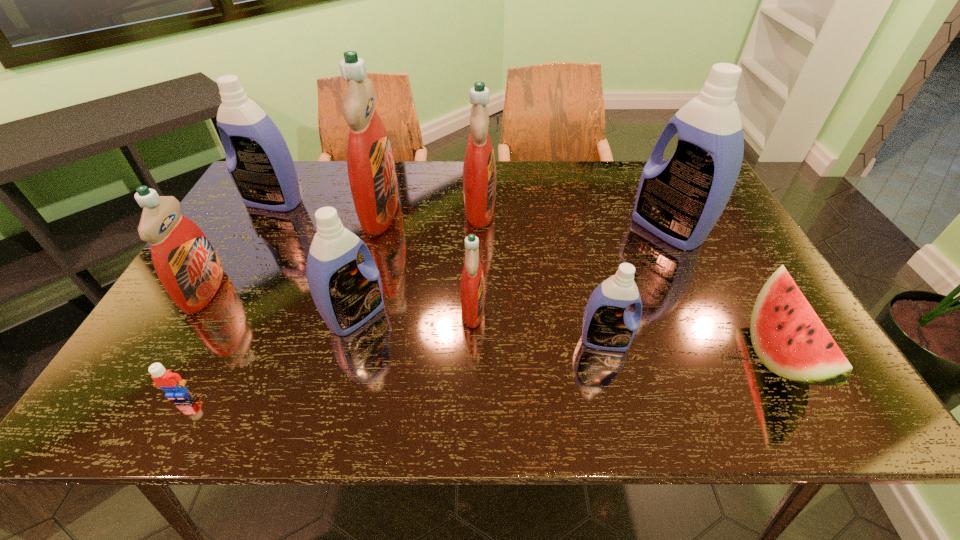
The width and height of the screenshot is (960, 540). Identify the location of the biggest red detergent. (371, 170).

Where is `the rightmost blue detergent`? The height and width of the screenshot is (540, 960). the rightmost blue detergent is located at coordinates (679, 200).

At what (x,y) coordinates should I click in order to perform the action: click on the rightmost detergent. Please return your answer as a coordinate pair (x, y). Looking at the image, I should click on (679, 200).

Identify the location of the third smallest red detergent. This screenshot has width=960, height=540. (479, 170).

Identify the location of the leftmost blue detergent. (261, 167).

I want to click on the second smallest red detergent, so click(188, 267).

At what (x,y) coordinates should I click in order to perform the action: click on the second smallest blue detergent. Please return your answer as a coordinate pair (x, y). Image resolution: width=960 pixels, height=540 pixels. Looking at the image, I should click on (347, 295).

The height and width of the screenshot is (540, 960). Identify the location of the smallest red detergent. (472, 285).

Locate an element on the screen. The image size is (960, 540). the seventh detergent from left to right is located at coordinates (607, 325).

Locate an element on the screen. the smallest blue detergent is located at coordinates (607, 325).